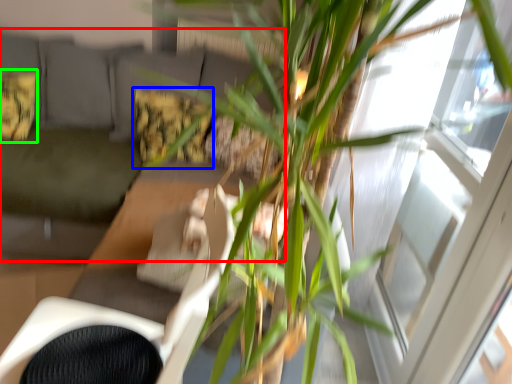
Question: Estimate the real-world distances between objects in this image. Which object is farther from couch (highlighted by a red box), pillow (highlighted by a blue box) or pillow (highlighted by a green box)?

Choices:
 (A) pillow
 (B) pillow

Answer: (A)